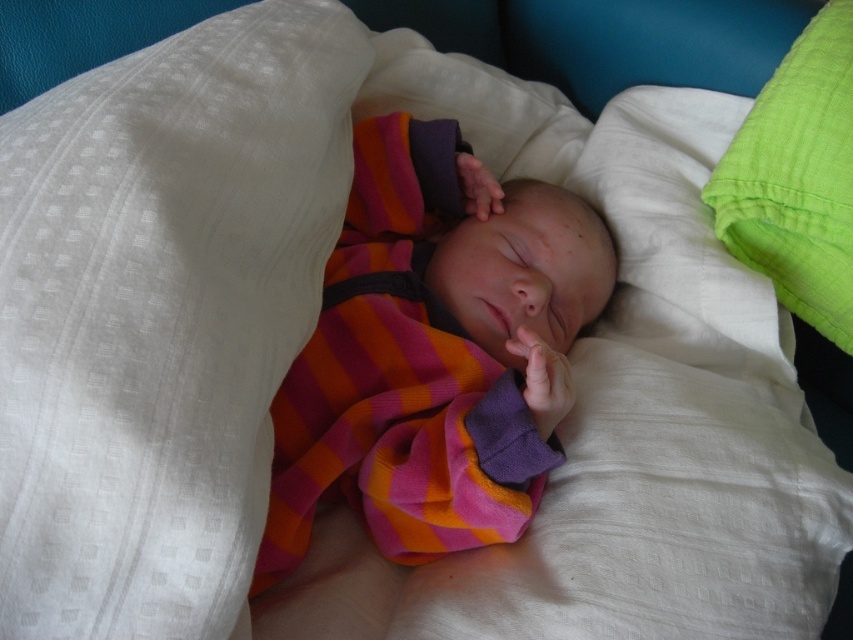
Can you confirm if white textured pillow at upper left is positioned to the left of striped fleece onesie at center?

Indeed, white textured pillow at upper left is positioned on the left side of striped fleece onesie at center.

Is point (289, 355) positioned before point (511, 392)?

Yes, point (289, 355) is in front of point (511, 392).

The image size is (853, 640). Find the location of `white textured pillow at upper left`. white textured pillow at upper left is located at coordinates (161, 314).

Identify the location of white textured pillow at upper left. This screenshot has width=853, height=640. point(161,314).

Who is shorter, white textured pillow at upper left or green cotton pillow at upper right?

With less height is green cotton pillow at upper right.

Does point (45, 193) come in front of point (769, 214)?

That is True.

The image size is (853, 640). Describe the element at coordinates (161, 314) in the screenshot. I see `white textured pillow at upper left` at that location.

What are the coordinates of `white textured pillow at upper left` in the screenshot? It's located at (161, 314).

Who is lower down, striped fleece onesie at center or green cotton pillow at upper right?

striped fleece onesie at center is below.

Locate an element on the screen. striped fleece onesie at center is located at coordinates (434, 352).

The image size is (853, 640). What are the coordinates of `striped fleece onesie at center` in the screenshot? It's located at (434, 352).